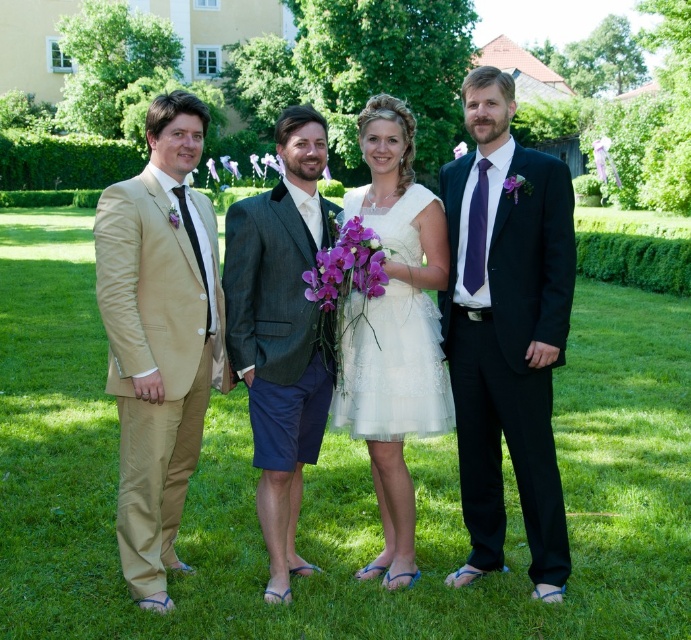
You are a photographer planning to take a group photo of the matte black suit at right and the tan satin suit at left. Based on their current positions, which suit is positioned closer to the camera?

The matte black suit at right is closer to the camera because the tan satin suit at left is behind it.

You are a photographer at a wedding and need to capture a shot of the white lace dress at center and the purple silk flower at center. Which object should you focus on first if you want to ensure both are in focus without adjusting the camera settings?

The white lace dress at center is located below the purple silk flower at center, so focusing on the purple silk flower at center first will ensure both are within the depth of field since it is farther away.

You are a photographer at a wedding and need to adjust your camera focus. You notice the tan satin suit at left and the purple fabric flower at center in your frame. Which object should you focus on first if you want to capture the larger object clearly?

The tan satin suit at left is larger in size than the purple fabric flower at center, so you should focus on the tan satin suit at left first to capture the larger object clearly.